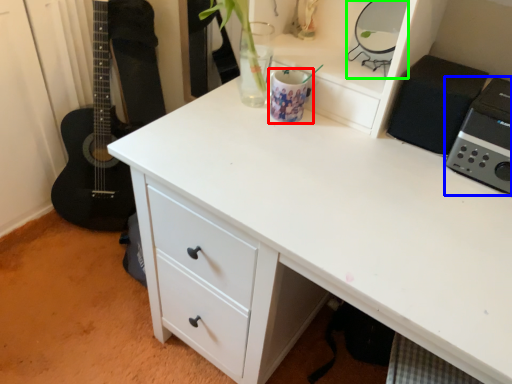
Question: Considering the real-world distances, which object is farthest from appliance (highlighted by a red box)? appliance (highlighted by a blue box) or appliance (highlighted by a green box)?

Choices:
 (A) appliance
 (B) appliance

Answer: (A)